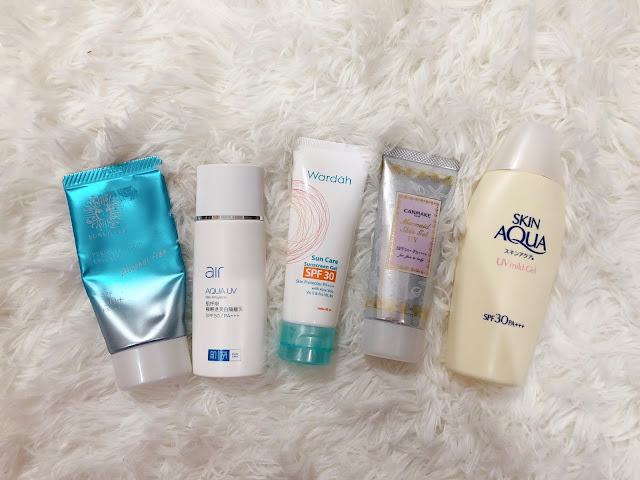
I want to click on decorative imagery, so click(x=308, y=215), click(x=404, y=310).